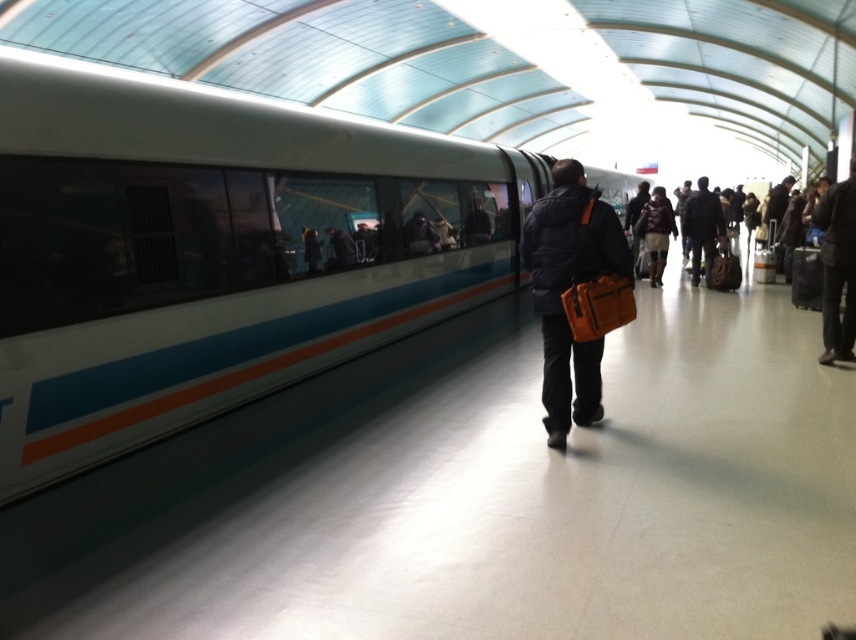
Question: Which object is the closest to the white glossy train at left?

Choices:
 (A) dark blue jacket at center-right
 (B) dark brown leather jacket at center

Answer: (B)

Question: Can you confirm if white glossy train at left is positioned to the right of matte black jacket at center?

Choices:
 (A) yes
 (B) no

Answer: (B)

Question: Can you confirm if white glossy train at left is bigger than matte black jacket at center?

Choices:
 (A) yes
 (B) no

Answer: (A)

Question: Which object is positioned farthest from the dark brown leather jacket at center?

Choices:
 (A) matte black jacket at center
 (B) white glossy train at left

Answer: (A)

Question: Among these objects, which one is farthest from the camera?

Choices:
 (A) dark blue jacket at center-right
 (B) matte black jacket at center
 (C) white glossy train at left

Answer: (A)

Question: Is matte black jacket at center to the right of dark blue jacket at center-right from the viewer's perspective?

Choices:
 (A) yes
 (B) no

Answer: (B)